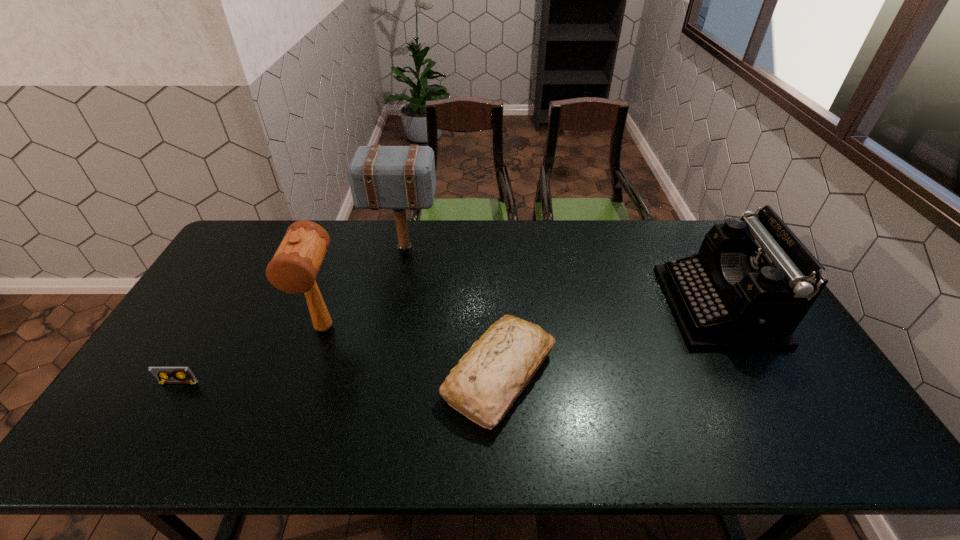
You are a GUI agent. You are given a task and a screenshot of the screen. Output one action in this format:
    pyautogui.click(x=<x>, y=<y>)
    Task: Click on the farthest object
    
    Given the screenshot: What is the action you would take?
    pyautogui.click(x=381, y=177)

Where is `the farther mallet`? the farther mallet is located at coordinates (x=381, y=177).

In order to click on the left mallet in this screenshot , I will do `click(293, 269)`.

Identify the location of the fourth object from right to left. (293, 269).

Locate an element on the screen. Image resolution: width=960 pixels, height=540 pixels. typewriter is located at coordinates (752, 282).

The image size is (960, 540). Find the location of `the rightmost object`. the rightmost object is located at coordinates (752, 282).

Where is `bread`? bread is located at coordinates (487, 380).

Locate an element on the screen. The height and width of the screenshot is (540, 960). the fourth tallest object is located at coordinates (487, 380).

You are a GUI agent. You are given a task and a screenshot of the screen. Output one action in this format:
    pyautogui.click(x=<x>, y=<y>)
    Task: Click on the leftmost object
    This screenshot has height=540, width=960.
    Given the screenshot: What is the action you would take?
    pyautogui.click(x=180, y=374)

Where is `videotape`? videotape is located at coordinates (180, 374).